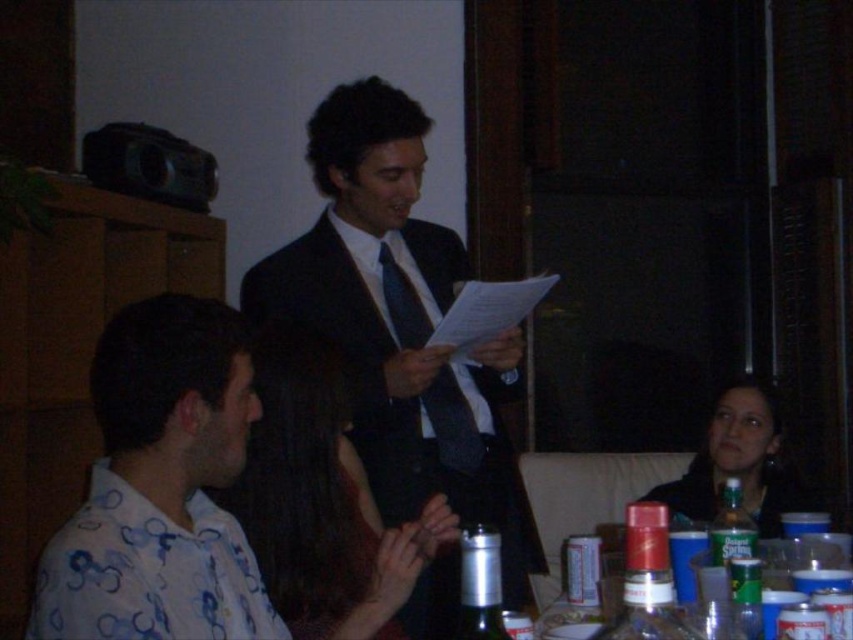
Which is in front, point (194, 406) or point (460, 612)?

Point (460, 612) is in front.

Can you confirm if white printed shirt at left is shorter than metallic silver bottle at center?

No, white printed shirt at left is not shorter than metallic silver bottle at center.

The height and width of the screenshot is (640, 853). Identify the location of white printed shirt at left. (160, 486).

Is point (119, 339) closer to camera compared to point (755, 456)?

That is True.

Where is `white printed shirt at left`? This screenshot has width=853, height=640. white printed shirt at left is located at coordinates (160, 486).

Is point (86, 554) in front of point (698, 493)?

Yes.

The height and width of the screenshot is (640, 853). I want to click on white printed shirt at left, so click(160, 486).

Is point (350, 541) closer to camera compared to point (698, 499)?

Yes, point (350, 541) is in front of point (698, 499).

Identify the location of smooth brown hair at center. (305, 486).

Locate an element on the screen. This screenshot has height=640, width=853. smooth brown hair at center is located at coordinates [305, 486].